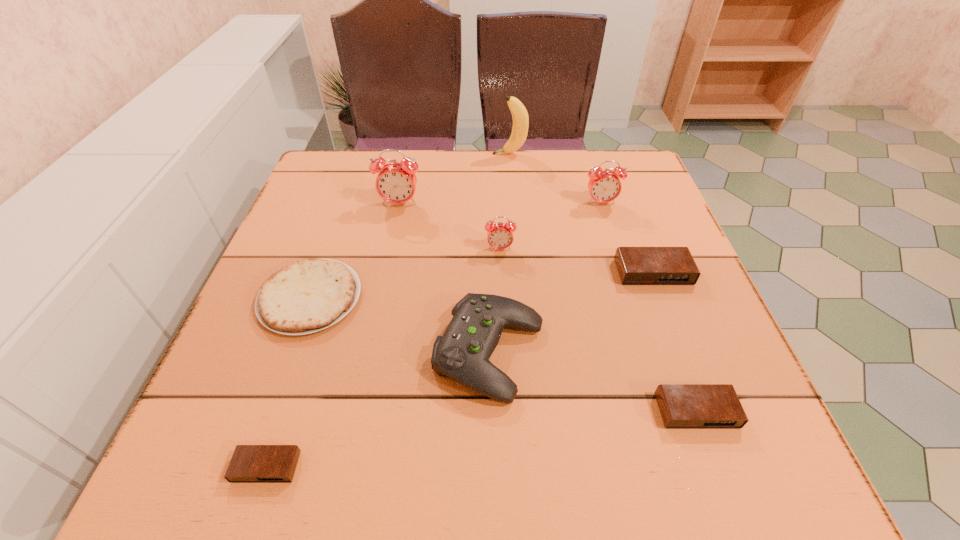
Find the location of a particular element. Image resolution: width=960 pixels, height=540 pixels. the farthest object is located at coordinates (519, 113).

Identify the location of the biggest red alarm clock. coord(396,183).

In order to click on the second alarm clock from left to right in this screenshot , I will do `click(396, 183)`.

You are a GUI agent. You are given a task and a screenshot of the screen. Output one action in this format:
    pyautogui.click(x=<x>, y=<y>)
    Task: Click on the second biggest red alarm clock
    This screenshot has width=960, height=540.
    Given the screenshot: What is the action you would take?
    pyautogui.click(x=604, y=186)

You are a GUI agent. You are given a task and a screenshot of the screen. Output one action in this format:
    pyautogui.click(x=<x>, y=<y>)
    Task: Click on the second tallest alarm clock
    
    Given the screenshot: What is the action you would take?
    pyautogui.click(x=604, y=186)

Where is `the third alarm clock from left to right`? The height and width of the screenshot is (540, 960). the third alarm clock from left to right is located at coordinates (499, 236).

The image size is (960, 540). Identify the location of the second red alarm clock from right to left. (499, 236).

Identify the location of the fifth shortest object. (462, 353).

Locate an element on the screen. the biggest black alarm clock is located at coordinates (636, 265).

The width and height of the screenshot is (960, 540). Find the location of `the farthest black alarm clock`. the farthest black alarm clock is located at coordinates (636, 265).